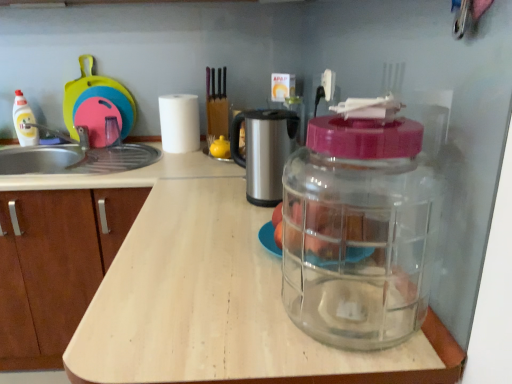
The width and height of the screenshot is (512, 384). What are the coordinates of `free spot to the left of stainless steel coffee maker at center` in the screenshot? It's located at (210, 198).